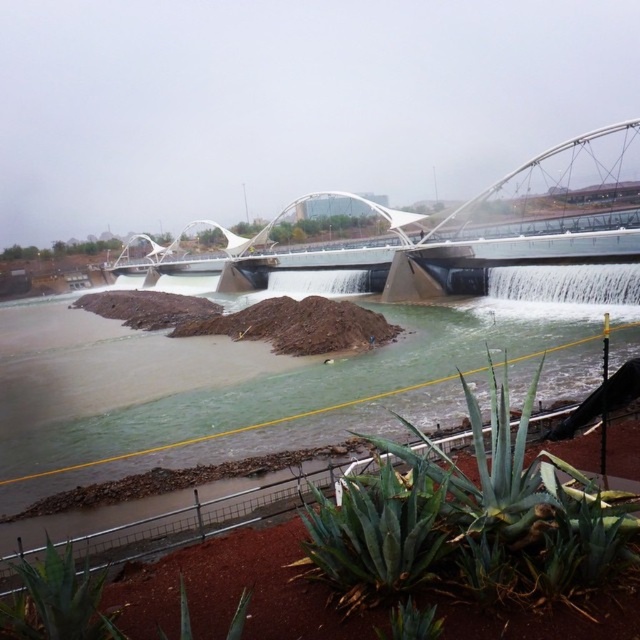
You are a landscape architect inspecting the riverbank and need to access both the brown sediment at center and the green succulent at lower center. Which object is closer to you and should you attend to first?

The brown sediment at center is closer to you than the green succulent at lower center, so you should attend to the brown sediment at center first.

You are standing at the yellow safety barrier in the landscaped area. You see two points marked in the image. Which point is closer to you, point 1 at coordinates point (465, 556) or point 2 at coordinates point (234, 637)?

Point 1 at coordinates point (465, 556) is closer to you because it is further to the viewer than point 2 at coordinates point (234, 637).

You are standing in the landscaped area with reddish brown soil and want to reach the yellow safety barrier without stepping on the green spiky plant at lower center. What is the minimum distance you need to move forward?

The minimum distance you need to move forward is 4.93 meters to reach the yellow safety barrier without stepping on the green spiky plant at lower center, as the plant is located 4.93 meters away from the viewer.